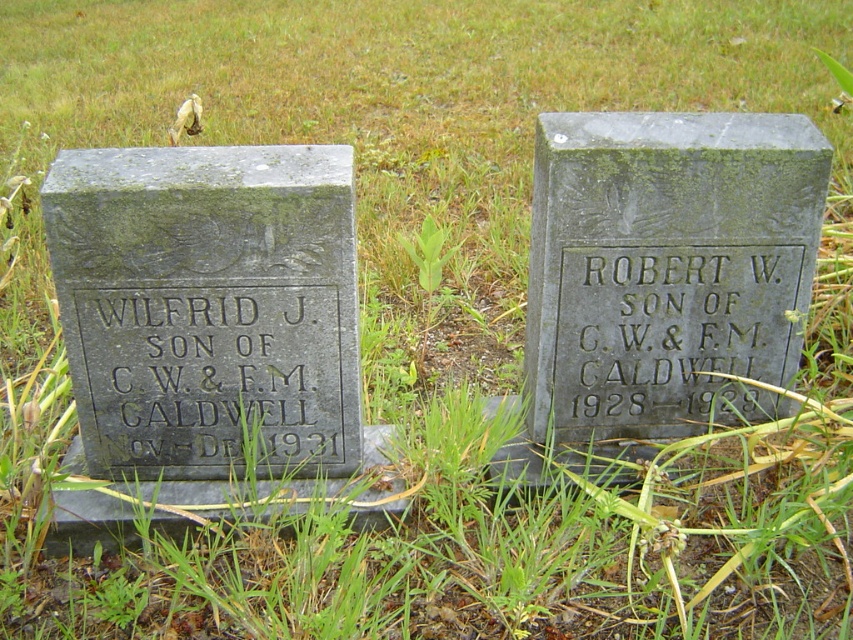
You are a groundskeeper tasked with maintaining the cemetery. You need to place a new decorative wreath between the gray stone gravestone at left and the black granite gravestone at center right. Given their widths, which gravestone should the wreath be closer to?

The gray stone gravestone at left has a larger width than the black granite gravestone at center right. Therefore, the wreath should be placed closer to the black granite gravestone at center right to ensure it is centered between them.

You are a groundskeeper tasked with maintaining the cemetery. You notice two gravestones, the gray stone gravestone at right and the black stone gravestone at left. Which gravestone has a greater width?

The gray stone gravestone at right has a greater width than the black stone gravestone at left.